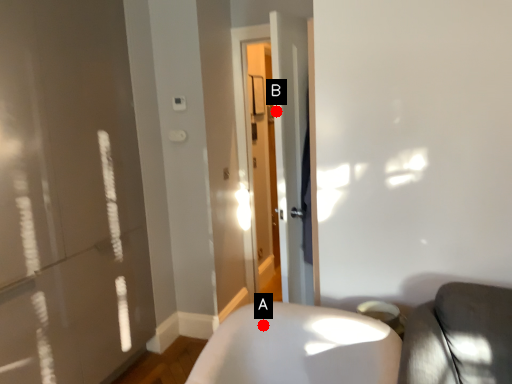
Question: Two points are circled on the image, labeled by A and B beside each circle. Which of the following is the farthest from the observer?

Choices:
 (A) A is further
 (B) B is further

Answer: (B)